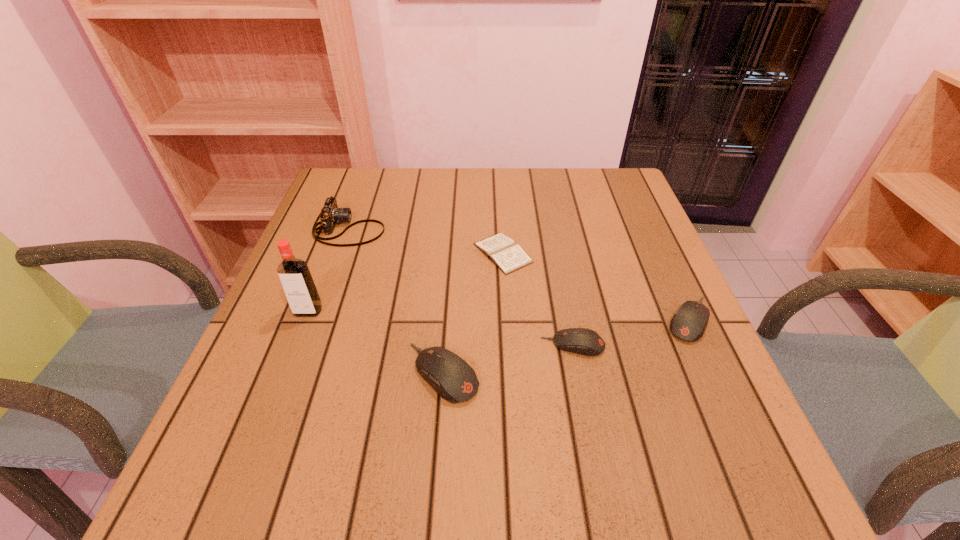
I want to click on the leftmost computer mouse, so click(x=449, y=375).

I want to click on the shortest computer mouse, so click(x=583, y=341).

Locate an element on the screen. This screenshot has height=540, width=960. the second shortest object is located at coordinates (583, 341).

Identify the location of the fourth tallest object. The height and width of the screenshot is (540, 960). pyautogui.click(x=689, y=322).

At what (x,y) coordinates should I click in order to perform the action: click on the rightmost computer mouse. Please return your answer as a coordinate pair (x, y). Image resolution: width=960 pixels, height=540 pixels. Looking at the image, I should click on (689, 322).

The image size is (960, 540). I want to click on diary, so click(x=503, y=251).

Locate an element on the screen. Image resolution: width=960 pixels, height=540 pixels. camera is located at coordinates (330, 214).

The image size is (960, 540). Find the location of `vodka`. vodka is located at coordinates (295, 277).

Locate an element on the screen. Image resolution: width=960 pixels, height=540 pixels. vacant space situated on the left of the leftmost computer mouse is located at coordinates (288, 373).

Identify the location of vacant space situated 0.140m on the front of the fifth tallest object. The image size is (960, 540). (588, 425).